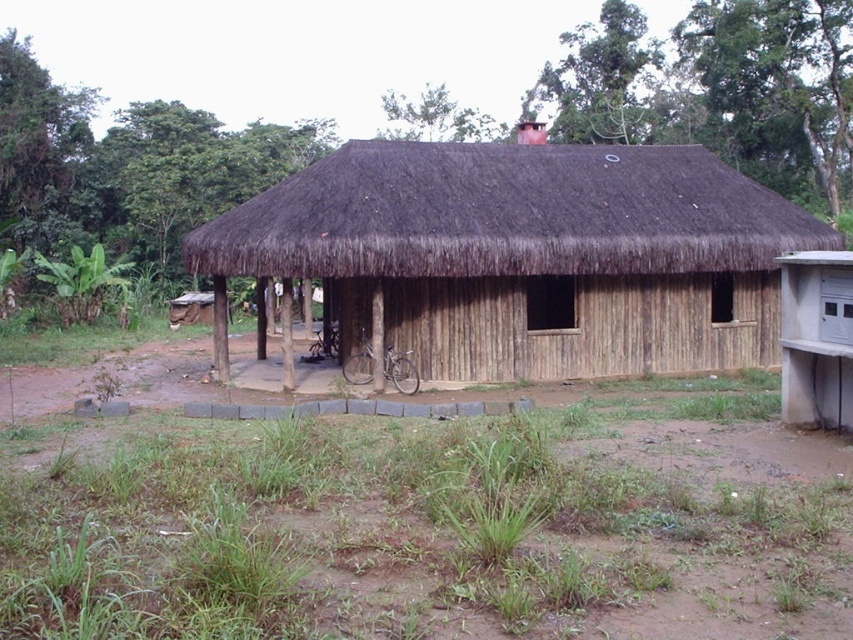
Question: Where is brown dirt field at center located in relation to brown thatch at center in the image?

Choices:
 (A) right
 (B) left

Answer: (B)

Question: Among these objects, which one is nearest to the camera?

Choices:
 (A) brown dirt field at center
 (B) brown thatch at center

Answer: (A)

Question: Can you confirm if brown dirt field at center is positioned below brown thatch at center?

Choices:
 (A) no
 (B) yes

Answer: (B)

Question: Does brown dirt field at center appear over brown thatch at center?

Choices:
 (A) no
 (B) yes

Answer: (A)